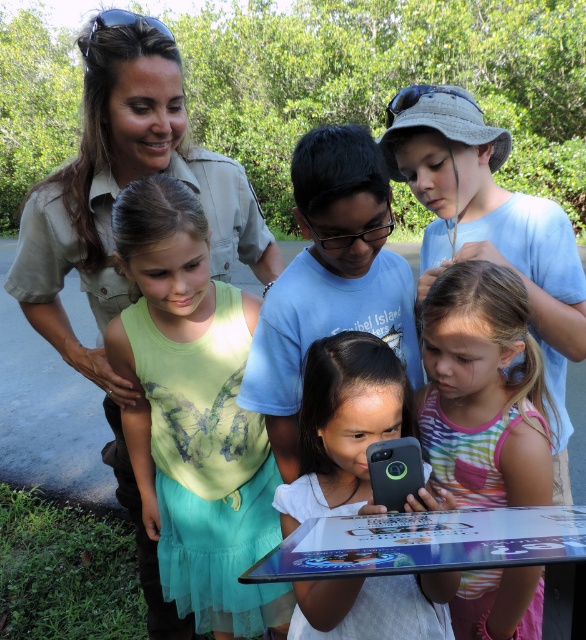
Question: Does matte khaki uniform at upper left appear over black matte smartphone at center?

Choices:
 (A) yes
 (B) no

Answer: (A)

Question: Among these objects, which one is nearest to the camera?

Choices:
 (A) green fabric dress at center
 (B) striped cotton tank top at center
 (C) matte khaki uniform at upper left
 (D) black matte smartphone at center

Answer: (D)

Question: Does striped cotton tank top at center have a lesser width compared to metallic silver tablet at center?

Choices:
 (A) no
 (B) yes

Answer: (B)

Question: Can you confirm if matte khaki uniform at upper left is positioned below striped cotton tank top at center?

Choices:
 (A) yes
 (B) no

Answer: (B)

Question: Which point is closer to the camera?

Choices:
 (A) (369, 552)
 (B) (206, 397)
 (C) (91, 44)
 (D) (362, 390)

Answer: (A)

Question: Which of the following is the closest to the observer?

Choices:
 (A) metallic silver tablet at center
 (B) matte khaki uniform at upper left

Answer: (A)